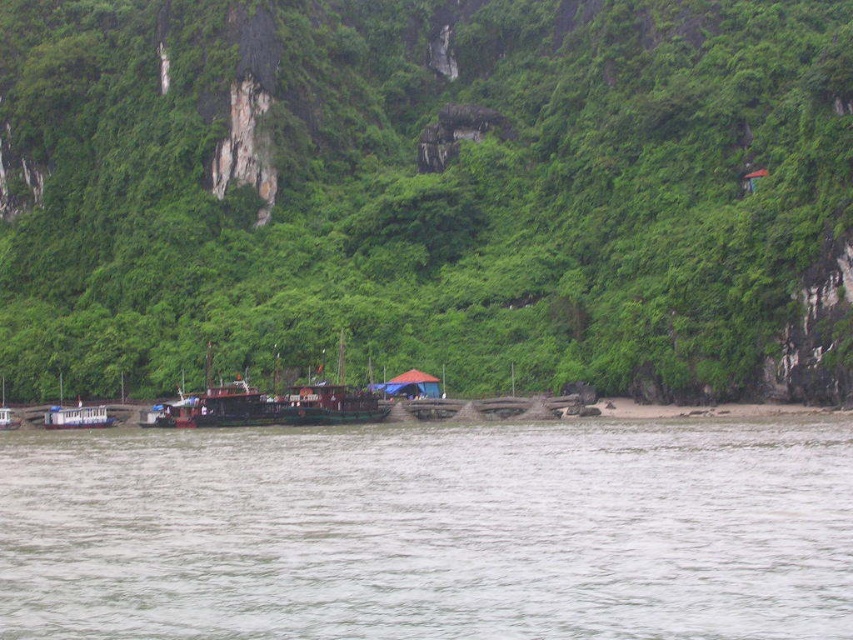
You are standing on the beach and want to take a photo of the green leafy vegetation at center. If your camera can focus on objects up to 100 meters away, will you need to move closer to get a clear shot?

The green leafy vegetation at center is 107.81 meters away, which is beyond the camera focus range of 100 meters. Move closer to ensure clear focus.

You are standing at the edge of the cliff overlooking the coastal scene. You notice two points marked in the image. The first point is at coordinate point (x=676, y=291) and the second is at coordinate point (x=113, y=420). Which point is closer to your current position?

Point (x=676, y=291) is in front of point (x=113, y=420), so it is closer to your current position at the cliff edge.

You are standing on the beach at the bottom right corner of the image. You see the gray matte water at lower center and the wooden boat at lower left. Which object is closer to you?

The gray matte water at lower center is closer to you because it is in front of the wooden boat at lower left.